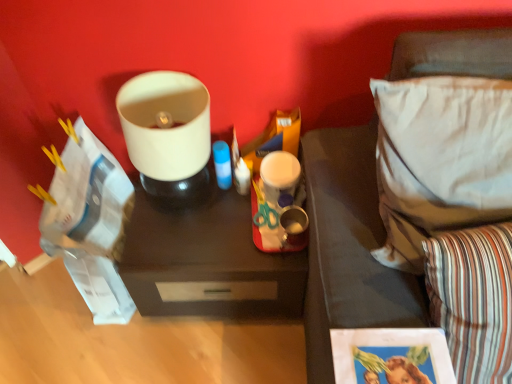
Locate an element on the screen. This screenshot has width=512, height=384. vacant space in front of matte white lampshade at upper center is located at coordinates (183, 246).